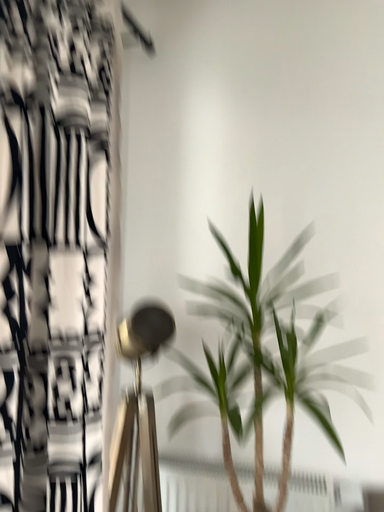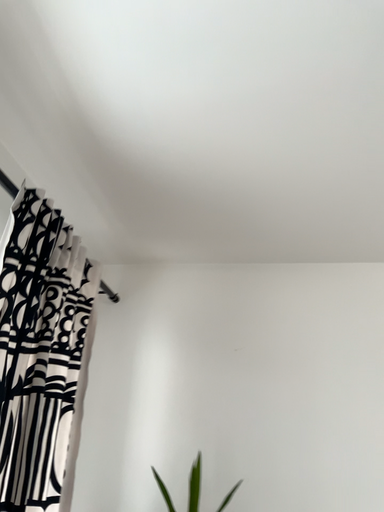
Question: How did the camera likely rotate when shooting the video?

Choices:
 (A) rotated left
 (B) rotated right

Answer: (B)